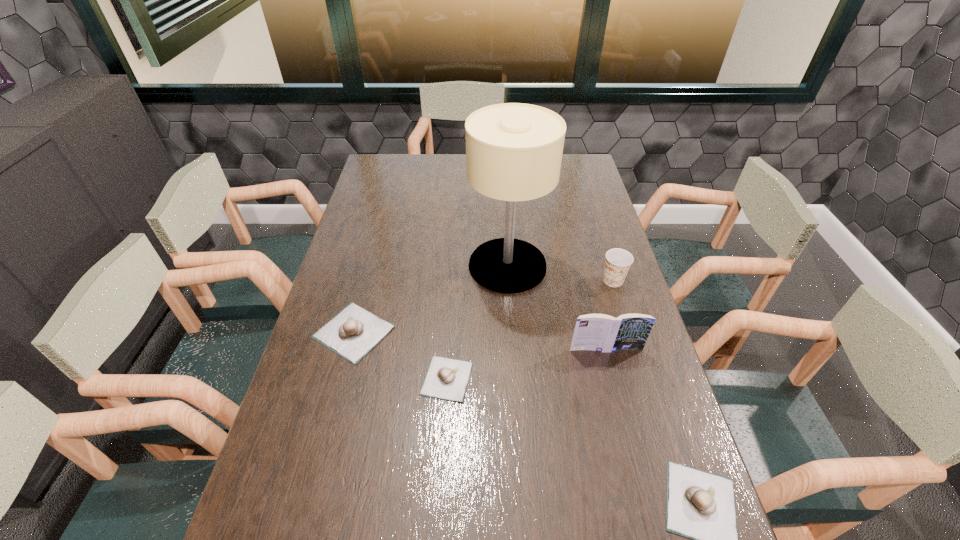
Find the location of `the leftmost garlic`. the leftmost garlic is located at coordinates (353, 332).

Where is `the second garlic from right to left`? Image resolution: width=960 pixels, height=540 pixels. the second garlic from right to left is located at coordinates (446, 378).

Locate an element on the screen. the shortest object is located at coordinates (446, 378).

Identify the location of the second tallest object. This screenshot has width=960, height=540. (x=598, y=332).

Locate an element on the screen. the third tallest object is located at coordinates click(x=618, y=261).

At what (x,y) coordinates should I click in order to perform the action: click on table lamp. Please return your answer as a coordinate pair (x, y). The height and width of the screenshot is (540, 960). Looking at the image, I should click on (514, 151).

At what (x,y) coordinates should I click in order to perform the action: click on vacant space located 0.280m on the front of the leftmost garlic. Please return your answer as a coordinate pair (x, y). The width and height of the screenshot is (960, 540). Looking at the image, I should click on (317, 474).

The image size is (960, 540). I want to click on vacant space located 0.130m on the front of the shortest object, so click(443, 455).

The width and height of the screenshot is (960, 540). Identify the location of free region located on the front cover of the fifth shortest object. (612, 372).

Locate an element on the screen. This screenshot has width=960, height=540. free space located 0.380m on the front of the third tallest object is located at coordinates click(x=650, y=400).